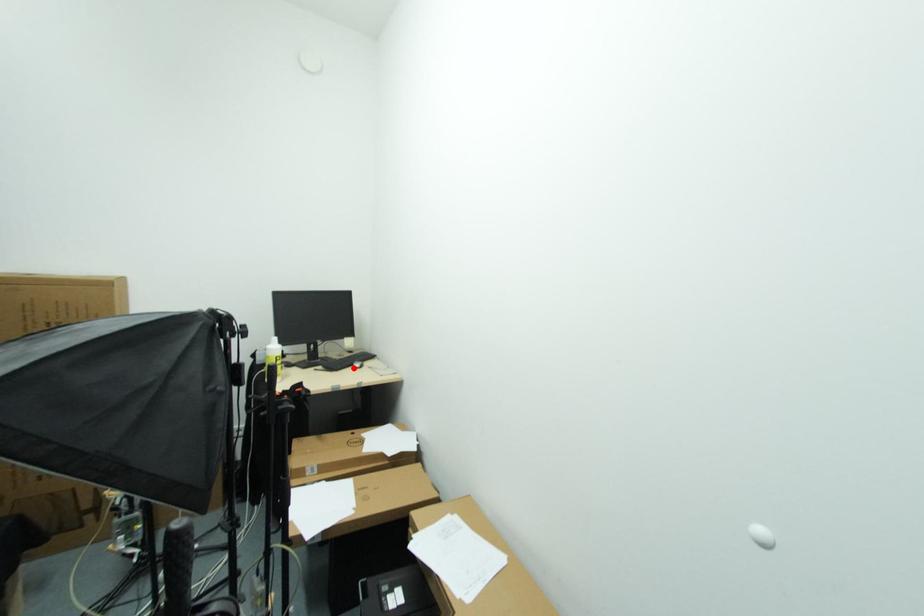
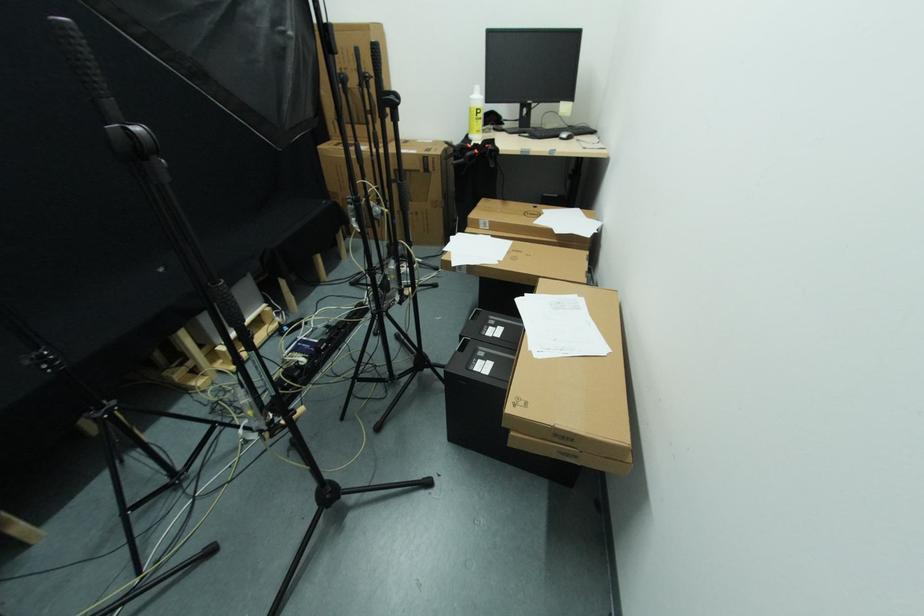
In the second image, find the point that corresponds to the highlighted location in the first image.

(561, 139)